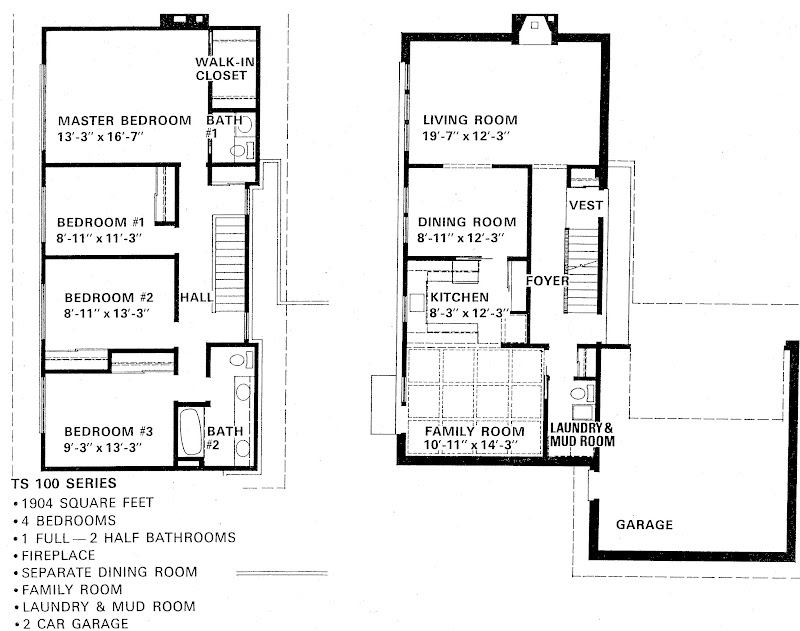
At what (x,y) coordinates should I click in order to perform the action: click on stairs. Please return your answer as a coordinate pair (x, y). This screenshot has width=800, height=631. Looking at the image, I should click on (234, 262), (586, 262).